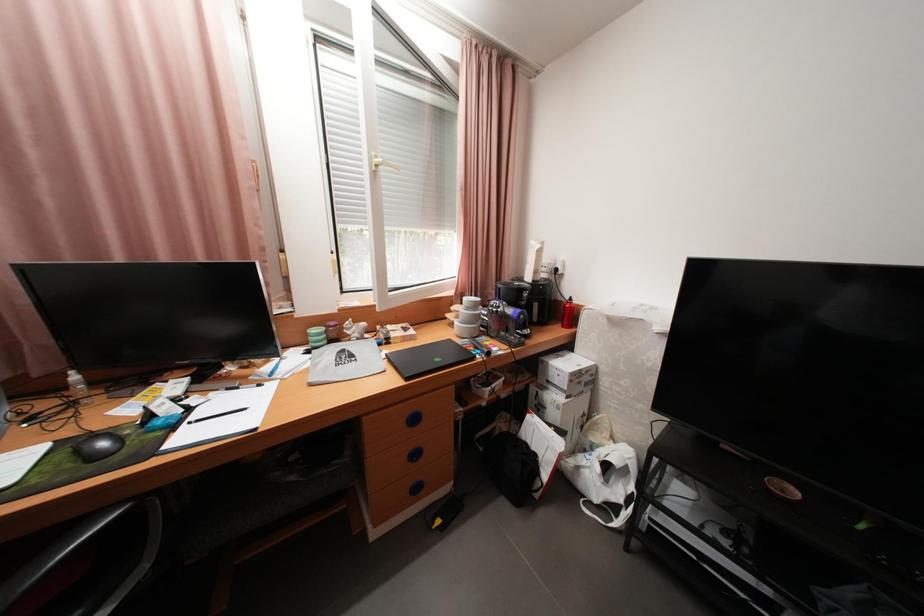
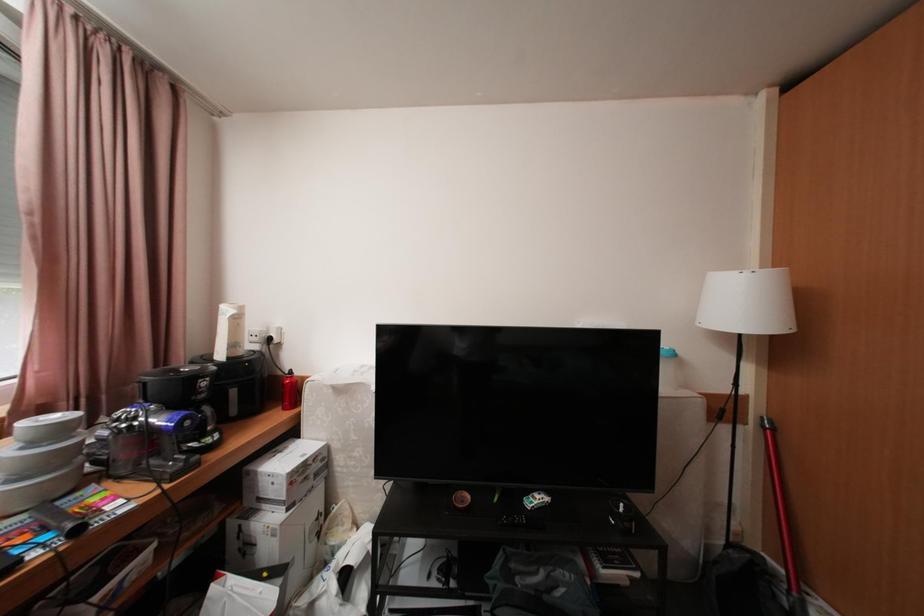
Question: The images are taken continuously from a first-person perspective. In which direction is your viewpoint rotating?

Choices:
 (A) Left
 (B) Right
 (C) Up
 (D) Down

Answer: (B)